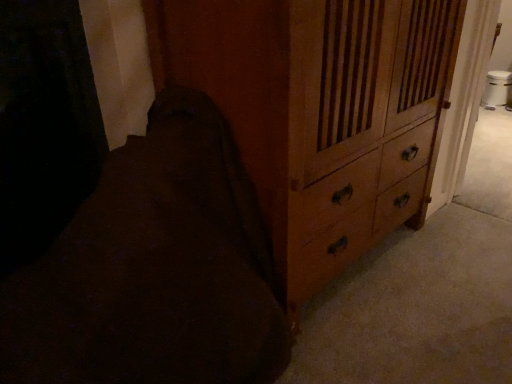
Question: Is dark brown fabric at lower left not close to wooden chest of drawers at center-right?

Choices:
 (A) no
 (B) yes

Answer: (A)

Question: Is the position of dark brown fabric at lower left more distant than that of wooden chest of drawers at center-right?

Choices:
 (A) yes
 (B) no

Answer: (B)

Question: From a real-world perspective, is dark brown fabric at lower left on wooden chest of drawers at center-right?

Choices:
 (A) no
 (B) yes

Answer: (A)

Question: From a real-world perspective, is dark brown fabric at lower left under wooden chest of drawers at center-right?

Choices:
 (A) no
 (B) yes

Answer: (B)

Question: Considering the relative sizes of dark brown fabric at lower left and wooden chest of drawers at center-right in the image provided, is dark brown fabric at lower left bigger than wooden chest of drawers at center-right?

Choices:
 (A) no
 (B) yes

Answer: (A)

Question: Can you confirm if dark brown fabric at lower left is shorter than wooden chest of drawers at center-right?

Choices:
 (A) no
 (B) yes

Answer: (B)

Question: Is dark brown fabric at lower left located within wooden chest of drawers at center-right?

Choices:
 (A) yes
 (B) no

Answer: (B)

Question: Is wooden chest of drawers at center-right positioned with its back to dark brown fabric at lower left?

Choices:
 (A) yes
 (B) no

Answer: (B)

Question: Considering the relative positions of wooden chest of drawers at center-right and dark brown fabric at lower left in the image provided, is wooden chest of drawers at center-right to the right of dark brown fabric at lower left from the viewer's perspective?

Choices:
 (A) no
 (B) yes

Answer: (B)

Question: Is wooden chest of drawers at center-right aimed at dark brown fabric at lower left?

Choices:
 (A) no
 (B) yes

Answer: (A)

Question: From the image's perspective, does wooden chest of drawers at center-right appear lower than dark brown fabric at lower left?

Choices:
 (A) yes
 (B) no

Answer: (B)

Question: Is wooden chest of drawers at center-right further to the viewer compared to dark brown fabric at lower left?

Choices:
 (A) no
 (B) yes

Answer: (B)

Question: Considering the positions of dark brown fabric at lower left and wooden chest of drawers at center-right in the image, is dark brown fabric at lower left wider or thinner than wooden chest of drawers at center-right?

Choices:
 (A) thin
 (B) wide

Answer: (B)